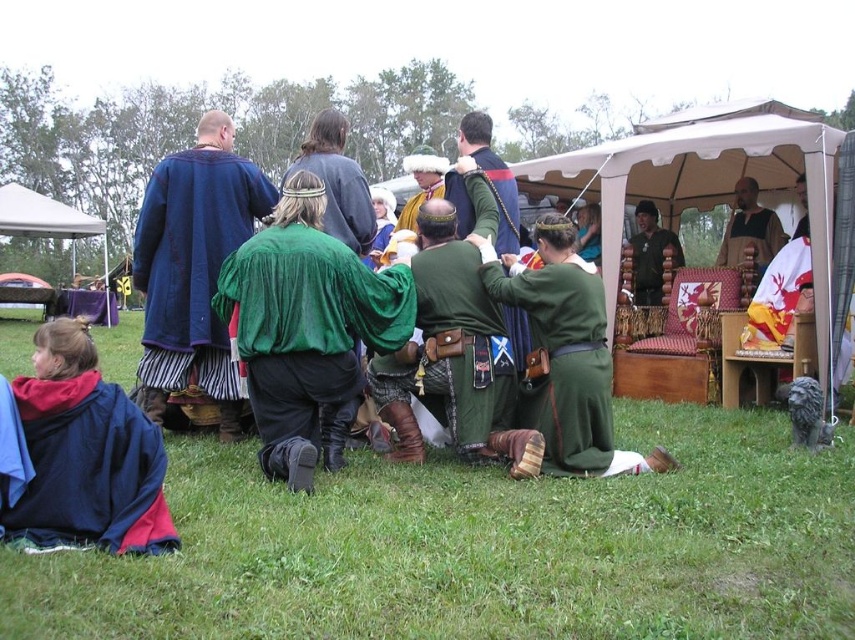
Question: Where is velvet green tunic at center located in relation to green fabric pants at center in the image?

Choices:
 (A) below
 (B) above

Answer: (B)

Question: Which of the following is the farthest from the observer?

Choices:
 (A) leather belt at center
 (B) dark blue fleece jacket at lower left
 (C) green leather boots at center
 (D) green fabric pants at center

Answer: (A)

Question: Which of the following is the farthest from the observer?

Choices:
 (A) green grass at lower center
 (B) velvet blue robe at center
 (C) wooden chair at center
 (D) smooth brown leather belt at upper right

Answer: (D)

Question: Is green grass at lower center smaller than velvet blue robe at upper left?

Choices:
 (A) yes
 (B) no

Answer: (A)

Question: Among these points, which one is nearest to the camera?

Choices:
 (A) (771, 218)
 (B) (646, 305)
 (C) (694, 168)

Answer: (A)

Question: Where is green leather boots at center located in relation to dark blue fleece jacket at lower left in the image?

Choices:
 (A) below
 (B) above

Answer: (B)